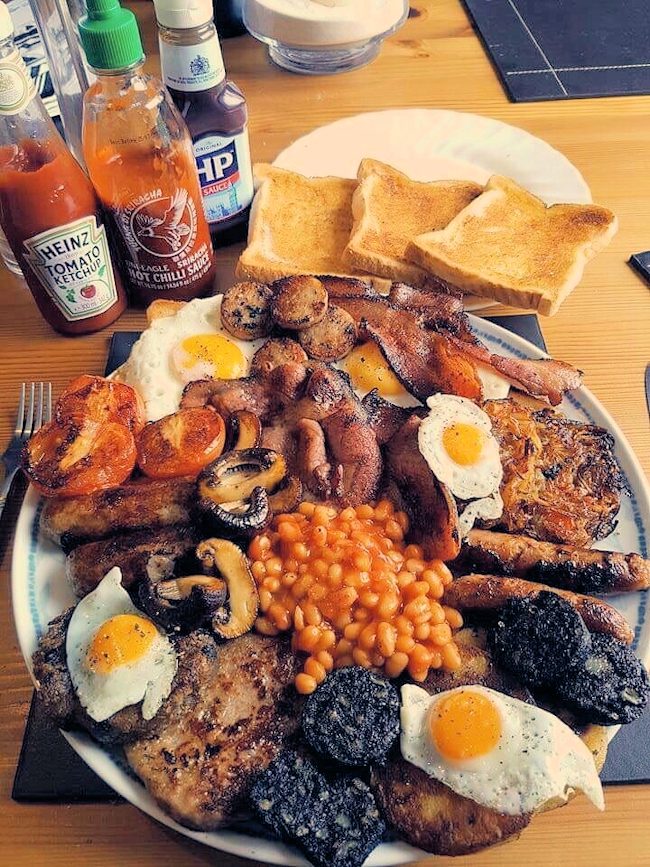
I want to click on plate, so click(x=53, y=575), click(x=474, y=142).